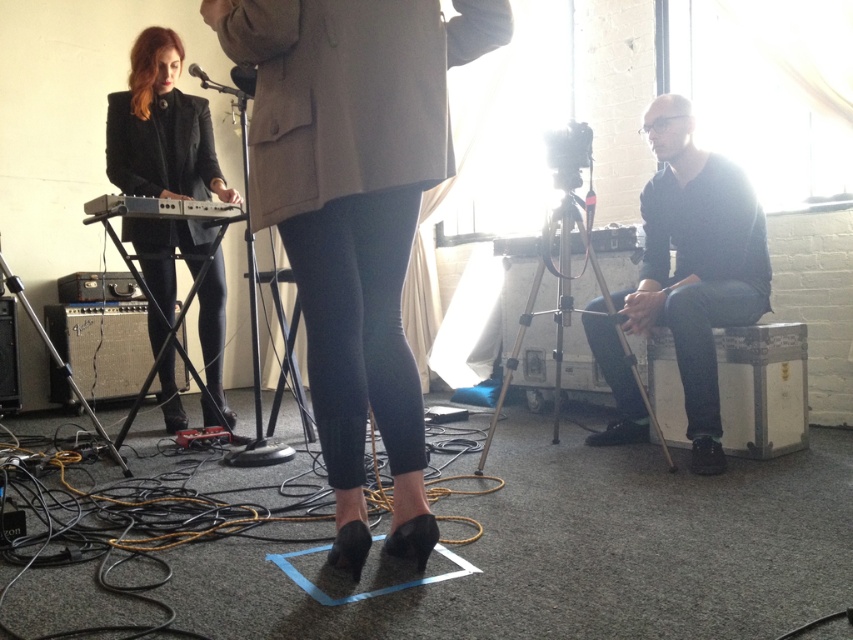
Is dark gray sweater at right smaller than matte black keyboard at left?

No.

How far apart are dark gray sweater at right and matte black keyboard at left?

The distance of dark gray sweater at right from matte black keyboard at left is 6.17 feet.

Does point (726, 163) come in front of point (227, 202)?

Yes, it is.

Identify the location of dark gray sweater at right. (695, 262).

Which of these two, matte black shoes at center or matte black keyboard at left, stands shorter?

matte black keyboard at left

How much distance is there between matte black shoes at center and matte black keyboard at left?

matte black shoes at center is 5.10 feet away from matte black keyboard at left.

Between point (358, 365) and point (239, 204), which one is positioned in front?

Positioned in front is point (358, 365).

Image resolution: width=853 pixels, height=640 pixels. I want to click on matte black shoes at center, so click(355, 211).

Which is below, matte black shoes at center or matte black jacket at left?

Positioned lower is matte black shoes at center.

Between matte black shoes at center and matte black jacket at left, which one has less height?

matte black shoes at center

You are a GUI agent. You are given a task and a screenshot of the screen. Output one action in this format:
    pyautogui.click(x=<x>, y=<y>)
    Task: Click on the matte black shoes at center
    
    Given the screenshot: What is the action you would take?
    pyautogui.click(x=355, y=211)

Find the location of a particular element. matte black shoes at center is located at coordinates (x=355, y=211).